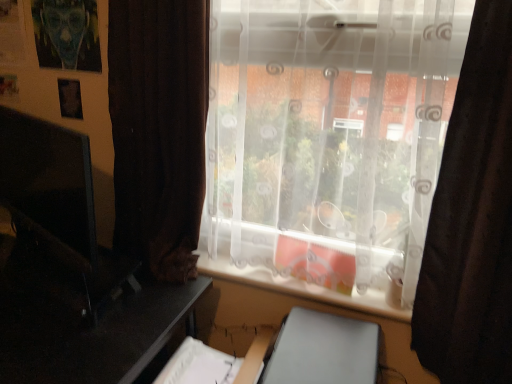
Question: Is transparent fabric at center in front of or behind matte black monitor at left in the image?

Choices:
 (A) behind
 (B) front

Answer: (B)

Question: Is transparent fabric at center wider or thinner than matte black monitor at left?

Choices:
 (A) thin
 (B) wide

Answer: (B)

Question: Which is nearer to the matte black monitor at left?

Choices:
 (A) white plastic window sill at center
 (B) transparent fabric at center
 (C) black glossy table at left
 (D) brown fabric curtain at right

Answer: (C)

Question: Which object is positioned closest to the matte black monitor at left?

Choices:
 (A) white plastic window sill at center
 (B) black glossy table at left
 (C) transparent fabric at center
 (D) brown fabric curtain at right

Answer: (B)